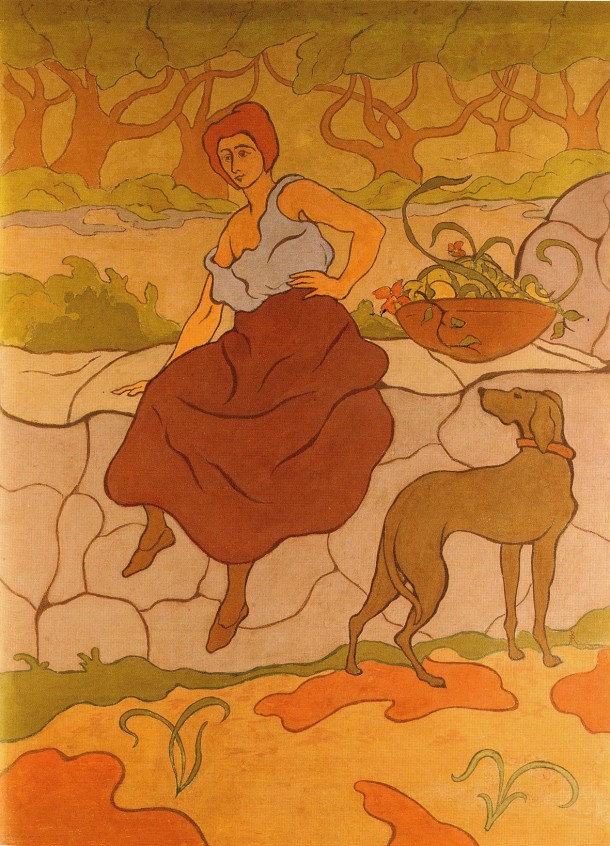
Locate an element on the screen. The width and height of the screenshot is (610, 846). gray stone wall is located at coordinates (57, 487), (439, 447), (590, 410), (593, 233).